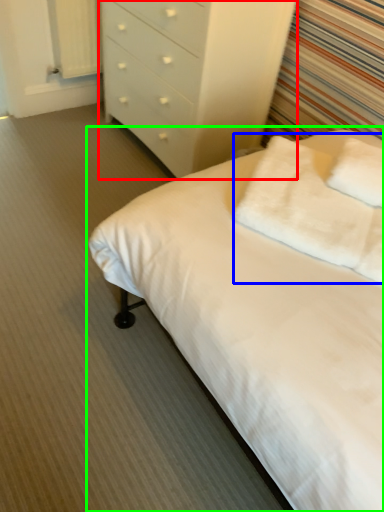
Question: Which object is positioned closest to chest of drawers (highlighted by a red box)? Select from pillow (highlighted by a blue box) and bed (highlighted by a green box).

Choices:
 (A) pillow
 (B) bed

Answer: (A)